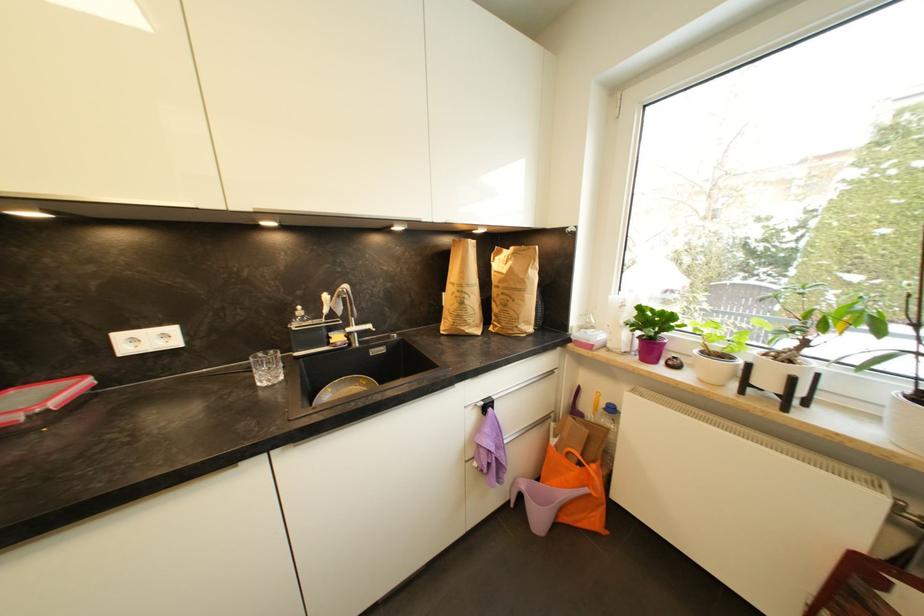
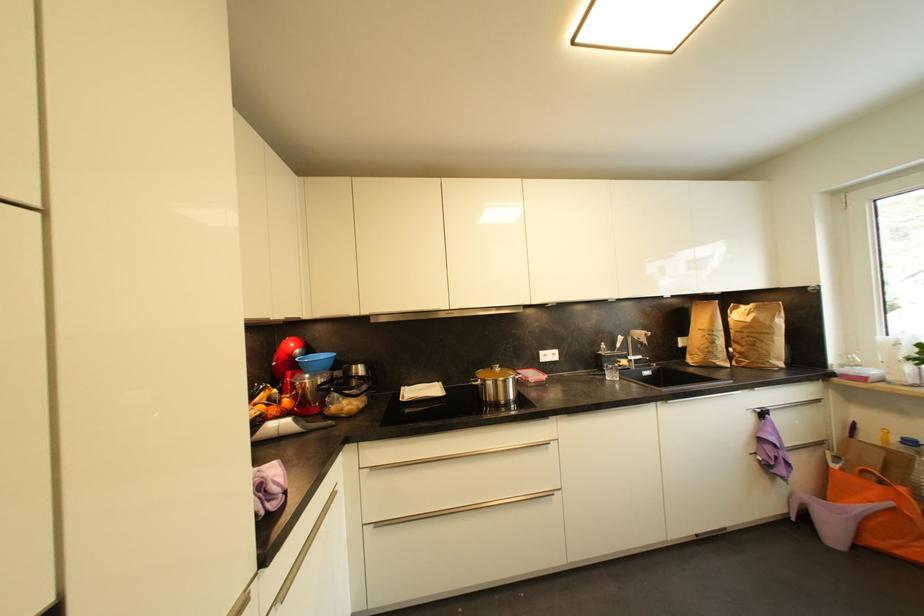
In the second image, find the point that corresponds to point (467, 305) in the first image.

(718, 345)